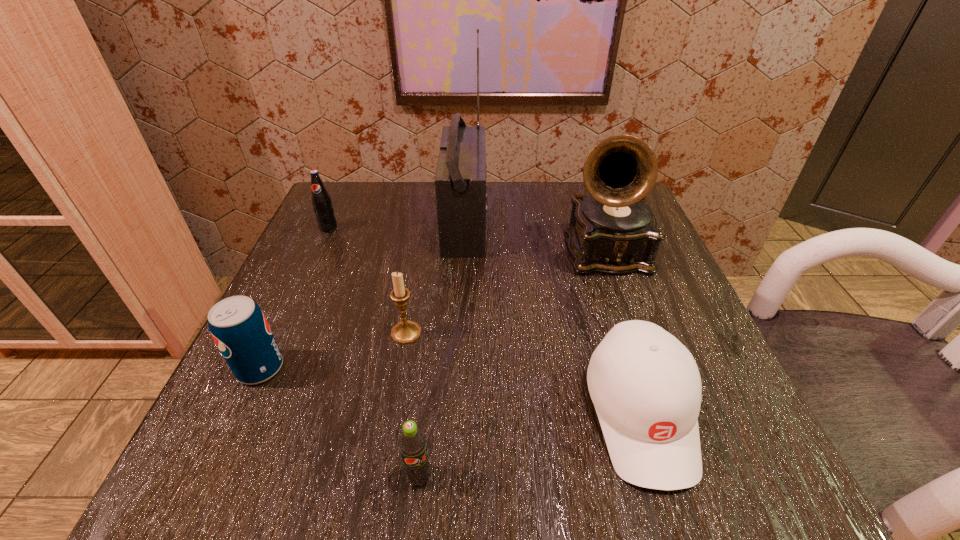
This screenshot has height=540, width=960. Identify the location of free space located on the front label of the farthest soda. (255, 390).

You are a GUI agent. You are given a task and a screenshot of the screen. Output one action in this format:
    pyautogui.click(x=<x>, y=<y>)
    Task: Click on the free point located 0.220m on the front of the third object from left to right
    
    Given the screenshot: What is the action you would take?
    (x=382, y=480)

Identify the location of vacant space located on the right of the second nearest soda. The height and width of the screenshot is (540, 960). (483, 368).

Where is `radio receiver that is at the far edge`? The width and height of the screenshot is (960, 540). radio receiver that is at the far edge is located at coordinates (460, 182).

This screenshot has height=540, width=960. What are the coordinates of `phonograph record present at the far edge` in the screenshot? It's located at (614, 231).

The height and width of the screenshot is (540, 960). Identify the location of pop that is at the far edge. (322, 204).

At what (x,y) coordinates should I click in order to perform the action: click on soda that is at the near edge. Please return your answer as a coordinate pair (x, y). The height and width of the screenshot is (540, 960). Looking at the image, I should click on (412, 443).

Identify the location of baseball cap situated at the near edge. (645, 385).

The image size is (960, 540). In order to click on phonograph record located in the right edge section of the desktop in this screenshot , I will do `click(614, 231)`.

Identify the location of baseball cap located in the right edge section of the desktop. The width and height of the screenshot is (960, 540). (645, 385).